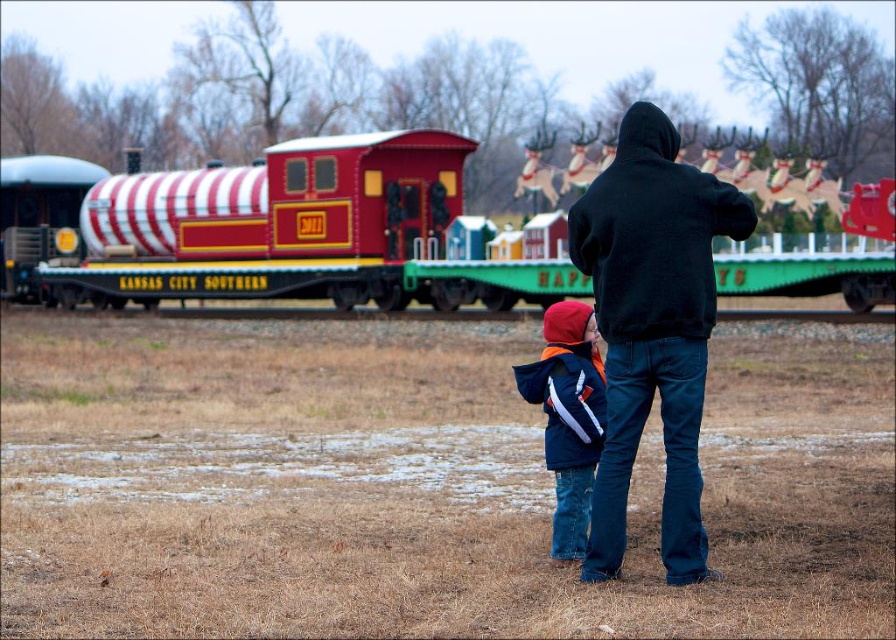
Can you confirm if red and white striped train car at upper center is smaller than navy blue jacket at center?

No.

Is red and white striped train car at upper center taller than navy blue jacket at center?

Correct, red and white striped train car at upper center is much taller as navy blue jacket at center.

Looking at this image, who is more distant from viewer, (840, 243) or (587, 426)?

Point (840, 243)

The height and width of the screenshot is (640, 896). I want to click on red and white striped train car at upper center, so click(x=273, y=230).

Who is higher up, black hoodie at center or navy blue jacket at center?

black hoodie at center is above.

Which is in front, point (616, 275) or point (558, 515)?

Point (616, 275) is more forward.

At what (x,y) coordinates should I click in order to perform the action: click on black hoodie at center. Please return your answer as a coordinate pair (x, y). This screenshot has width=896, height=640. Looking at the image, I should click on (652, 326).

Does red and white striped train car at upper center have a smaller size compared to black hoodie at center?

Actually, red and white striped train car at upper center might be larger than black hoodie at center.

Looking at this image, is red and white striped train car at upper center taller than black hoodie at center?

Yes, red and white striped train car at upper center is taller than black hoodie at center.

From the picture: Measure the distance between point (x=242, y=284) and camera.

Point (x=242, y=284) is 40.54 meters away from camera.

The width and height of the screenshot is (896, 640). I want to click on red and white striped train car at upper center, so click(x=273, y=230).